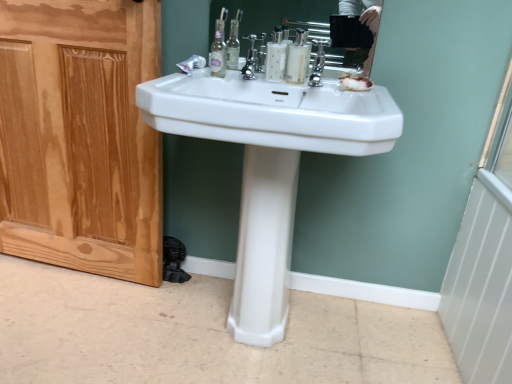
Describe the element at coordinates (298, 58) in the screenshot. The height and width of the screenshot is (384, 512). I see `white glossy mouthwash at center, which ranks as the 2th mouthwash in left-to-right order` at that location.

Describe the element at coordinates (275, 57) in the screenshot. I see `white glossy mouthwash at center, the 2th mouthwash viewed from the right` at that location.

What do you see at coordinates (251, 58) in the screenshot?
I see `polished chrome faucet at center` at bounding box center [251, 58].

Describe the element at coordinates (355, 83) in the screenshot. I see `marbled white soap at center` at that location.

What are the coordinates of `white glossy pedestal at center` in the screenshot? It's located at (264, 246).

Where is `white glossy sink at center`? The image size is (512, 384). white glossy sink at center is located at coordinates (272, 113).

Which object is more forward, white glossy sink at center or polished chrome tap at center?

white glossy sink at center is in front.

Is white glossy sink at center not inside polished chrome tap at center?

white glossy sink at center is positioned outside polished chrome tap at center.

Who is bigger, white glossy sink at center or polished chrome tap at center?

white glossy sink at center is bigger.

At what (x,y) coordinates should I click in order to perform the action: click on tap above the white glossy sink at center (from a real-world perspective). Please return your answer as a coordinate pair (x, y). The image size is (512, 384). Looking at the image, I should click on (318, 64).

Is white glossy mouthwash at center, the 2th mouthwash viewed from the right, taller or shorter than marbled white soap at center?

white glossy mouthwash at center, the 2th mouthwash viewed from the right, is taller than marbled white soap at center.

Is white glossy mouthwash at center, the 2th mouthwash viewed from the right, thinner than marbled white soap at center?

Correct, the width of white glossy mouthwash at center, the 2th mouthwash viewed from the right, is less than that of marbled white soap at center.

From the image's perspective, between white glossy mouthwash at center, marked as the first mouthwash in a left-to-right arrangement, and marbled white soap at center, which one is located above?

white glossy mouthwash at center, marked as the first mouthwash in a left-to-right arrangement.

Can we say white glossy mouthwash at center, the 2th mouthwash viewed from the right, lies outside marbled white soap at center?

Absolutely, white glossy mouthwash at center, the 2th mouthwash viewed from the right, is external to marbled white soap at center.

Is polished chrome tap at center not near white glossy sink at center?

They are positioned close to each other.

Between polished chrome tap at center and white glossy sink at center, which one has less height?

With less height is polished chrome tap at center.

From a real-world perspective, who is located lower, polished chrome tap at center or white glossy sink at center?

white glossy sink at center, from a real-world perspective.

In terms of size, does polished chrome tap at center appear bigger or smaller than white glossy sink at center?

In the image, polished chrome tap at center appears to be smaller than white glossy sink at center.

From the image's perspective, does marbled white soap at center appear lower than natural wood screen door at left?

Incorrect, from the image's perspective, marbled white soap at center is higher than natural wood screen door at left.

Which point is more forward, [362,86] or [72,188]?

The point [362,86] is more forward.

From a real-world perspective, which object stands above the other?

marbled white soap at center is physically above.

Considering the sizes of objects marbled white soap at center and natural wood screen door at left in the image provided, who is bigger, marbled white soap at center or natural wood screen door at left?

With larger size is natural wood screen door at left.

From the image's perspective, is white glossy mouthwash at center, marked as the first mouthwash in a left-to-right arrangement, positioned above or below white glossy sink at center?

white glossy mouthwash at center, marked as the first mouthwash in a left-to-right arrangement, is situated higher than white glossy sink at center in the image.

Considering the positions of point (269, 70) and point (265, 144), is point (269, 70) closer or farther from the camera than point (265, 144)?

Point (269, 70) is farther from the camera than point (265, 144).

What's the angular difference between white glossy mouthwash at center, the 2th mouthwash viewed from the right, and white glossy sink at center's facing directions?

2.54 degrees separate the facing orientations of white glossy mouthwash at center, the 2th mouthwash viewed from the right, and white glossy sink at center.

At what (x,y) coordinates should I click in order to perform the action: click on faucet above the white glossy pedestal at center (from the image's perspective). Please return your answer as a coordinate pair (x, y). The width and height of the screenshot is (512, 384). Looking at the image, I should click on (251, 58).

Which object is further away from the camera taking this photo, polished chrome faucet at center or white glossy pedestal at center?

polished chrome faucet at center is more distant.

In the scene shown: Is polished chrome faucet at center shorter than white glossy pedestal at center?

Yes, polished chrome faucet at center is shorter than white glossy pedestal at center.

From the image's perspective, is polished chrome faucet at center beneath white glossy pedestal at center?

Actually, polished chrome faucet at center appears above white glossy pedestal at center in the image.

Is white glossy mouthwash at center, the 2th mouthwash viewed from the right, bigger than white glossy pedestal at center?

Actually, white glossy mouthwash at center, the 2th mouthwash viewed from the right, might be smaller than white glossy pedestal at center.

Which is more to the right, white glossy mouthwash at center, the 2th mouthwash viewed from the right, or white glossy pedestal at center?

From the viewer's perspective, white glossy mouthwash at center, the 2th mouthwash viewed from the right, appears more on the right side.

From a real-world perspective, which object rests below the other?

white glossy pedestal at center, from a real-world perspective.

Considering the positions of objects white glossy mouthwash at center, the 2th mouthwash viewed from the right, and white glossy pedestal at center in the image provided, who is behind, white glossy mouthwash at center, the 2th mouthwash viewed from the right, or white glossy pedestal at center?

white glossy mouthwash at center, the 2th mouthwash viewed from the right.

The width and height of the screenshot is (512, 384). What are the coordinates of `tap above the white glossy sink at center (from the image's perspective)` in the screenshot? It's located at (318, 64).

The height and width of the screenshot is (384, 512). I want to click on soap located on the right of white glossy mouthwash at center, the 2th mouthwash viewed from the right, so click(x=355, y=83).

Estimate the real-world distances between objects in this image. Which object is further from white glossy sink at center, marbled white soap at center or polished chrome tap at center?

marbled white soap at center is positioned further to the anchor white glossy sink at center.

Considering their positions, is white glossy mouthwash at center, which ranks as the 2th mouthwash in left-to-right order, positioned further to polished chrome tap at center than white glossy pedestal at center?

Among the two, white glossy pedestal at center is located further to polished chrome tap at center.

From the image, which object appears to be farther from white glossy pedestal at center, natural wood screen door at left or polished chrome tap at center?

The object further to white glossy pedestal at center is natural wood screen door at left.

Looking at the image, which one is located further to marbled white soap at center, polished chrome tap at center or white glossy mouthwash at center, which ranks as the 2th mouthwash in left-to-right order?

Among the two, white glossy mouthwash at center, which ranks as the 2th mouthwash in left-to-right order, is located further to marbled white soap at center.

In the scene shown: Looking at the image, which one is located further to polished chrome faucet at center, polished chrome tap at center or natural wood screen door at left?

natural wood screen door at left.

Looking at the image, which one is located further to white glossy sink at center, natural wood screen door at left or white glossy mouthwash at center, which ranks as the 2th mouthwash in left-to-right order?

Among the two, natural wood screen door at left is located further to white glossy sink at center.

Looking at the image, which one is located closer to marbled white soap at center, white glossy sink at center or white glossy mouthwash at center, the 2th mouthwash viewed from the right?

white glossy mouthwash at center, the 2th mouthwash viewed from the right.

Which object lies further to the anchor point white glossy mouthwash at center, acting as the 1th mouthwash starting from the right, natural wood screen door at left or marbled white soap at center?

natural wood screen door at left is further to white glossy mouthwash at center, acting as the 1th mouthwash starting from the right.

This screenshot has width=512, height=384. I want to click on faucet between natural wood screen door at left and white glossy pedestal at center from left to right, so click(x=251, y=58).

Locate an element on the screen. The width and height of the screenshot is (512, 384). mouthwash that lies between white glossy mouthwash at center, marked as the first mouthwash in a left-to-right arrangement, and white glossy pedestal at center from top to bottom is located at coordinates (298, 58).

The image size is (512, 384). In order to click on tap between white glossy mouthwash at center, the 2th mouthwash viewed from the right, and marbled white soap at center from left to right in this screenshot , I will do `click(318, 64)`.

The width and height of the screenshot is (512, 384). What are the coordinates of `tap between white glossy mouthwash at center, which ranks as the 2th mouthwash in left-to-right order, and marbled white soap at center from left to right` in the screenshot? It's located at (318, 64).